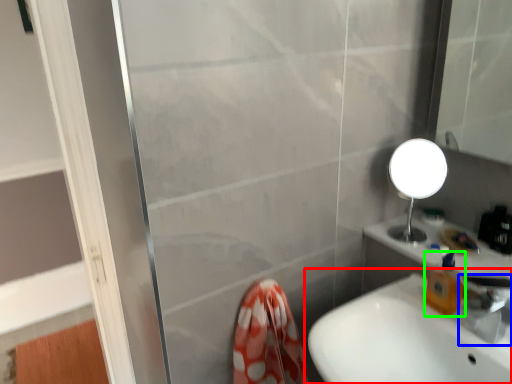
Question: Which object is the closest to the sink (highlighted by a red box)? Choose among these: tap (highlighted by a blue box) or soap dispenser (highlighted by a green box).

Choices:
 (A) tap
 (B) soap dispenser

Answer: (B)